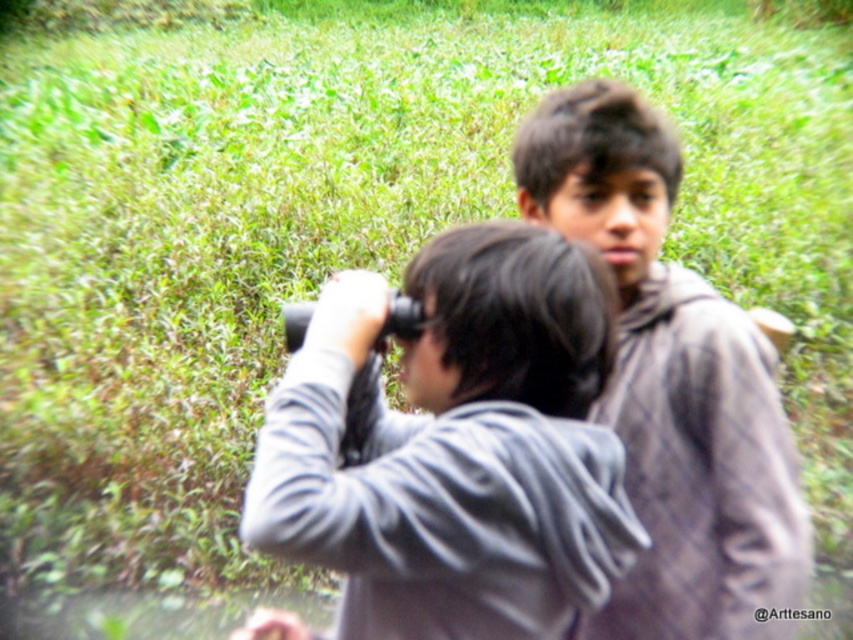
Question: Where is gray matte jacket at center located in relation to gray woolen sweater at center in the image?

Choices:
 (A) below
 (B) above

Answer: (A)

Question: Considering the relative positions of gray matte jacket at center and gray woolen sweater at center in the image provided, where is gray matte jacket at center located with respect to gray woolen sweater at center?

Choices:
 (A) left
 (B) right

Answer: (A)

Question: Observing the image, what is the correct spatial positioning of gray matte jacket at center in reference to gray woolen sweater at center?

Choices:
 (A) below
 (B) above

Answer: (A)